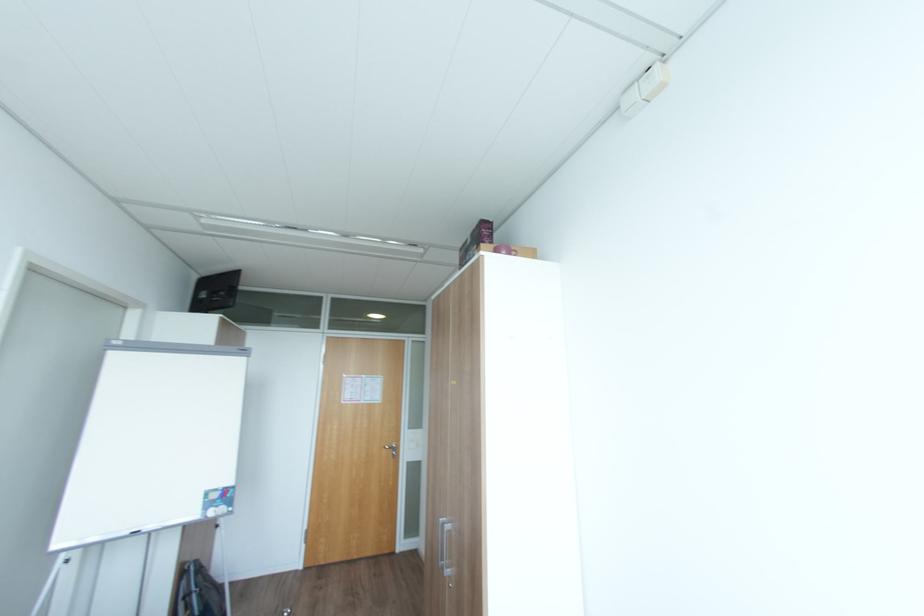
At what (x,y) coordinates should I click in order to perform the action: click on purple cardboard box. Please return your answer as a coordinate pair (x, y). The width and height of the screenshot is (924, 616). Looking at the image, I should click on (476, 240).